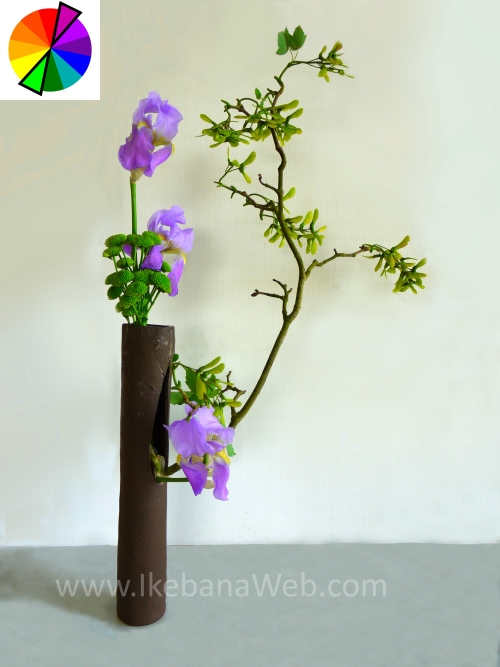
At what (x,y) coordinates should I click in order to perform the action: click on table top. Please return your answer as a coordinate pair (x, y). Looking at the image, I should click on (391, 613).